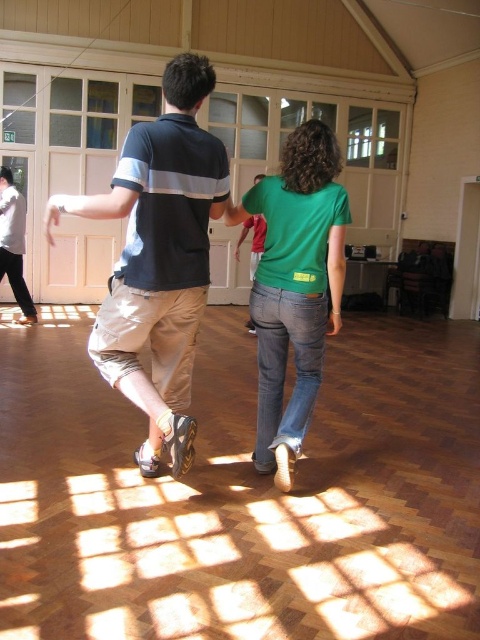
Question: Can you confirm if matte black polo shirt at center is bigger than green cotton shirt at center?

Choices:
 (A) yes
 (B) no

Answer: (A)

Question: Does matte black polo shirt at center appear over green cotton shirt at center?

Choices:
 (A) no
 (B) yes

Answer: (B)

Question: Which point appears farthest from the camera in this image?

Choices:
 (A) (144, 326)
 (B) (268, 419)

Answer: (B)

Question: Is matte black polo shirt at center above green cotton shirt at center?

Choices:
 (A) yes
 (B) no

Answer: (A)